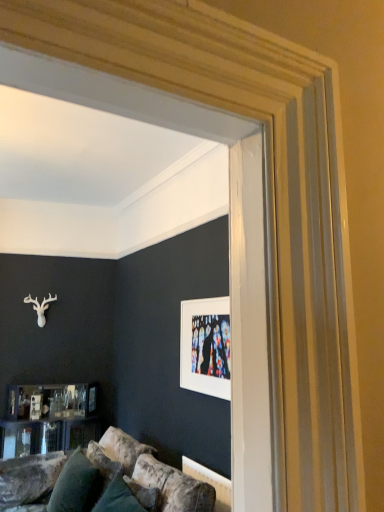
Question: Considering the relative sizes of white matte picture frame at upper center and velvety green pillow at lower left in the image provided, is white matte picture frame at upper center wider than velvety green pillow at lower left?

Choices:
 (A) no
 (B) yes

Answer: (A)

Question: From a real-world perspective, is white matte picture frame at upper center located higher than velvety green pillow at lower left?

Choices:
 (A) yes
 (B) no

Answer: (A)

Question: From the image's perspective, is white matte picture frame at upper center above velvety green pillow at lower left?

Choices:
 (A) no
 (B) yes

Answer: (B)

Question: Can you confirm if white matte picture frame at upper center is smaller than velvety green pillow at lower left?

Choices:
 (A) yes
 (B) no

Answer: (A)

Question: Is white matte picture frame at upper center positioned with its back to velvety green pillow at lower left?

Choices:
 (A) yes
 (B) no

Answer: (B)

Question: Does white matte picture frame at upper center appear on the right side of velvety green pillow at lower left?

Choices:
 (A) no
 (B) yes

Answer: (B)

Question: Is velvety green pillow at lower left far from white matte picture frame at upper center?

Choices:
 (A) no
 (B) yes

Answer: (B)

Question: From the image's perspective, would you say velvety green pillow at lower left is shown under white matte picture frame at upper center?

Choices:
 (A) yes
 (B) no

Answer: (A)

Question: Is velvety green pillow at lower left wider than white matte picture frame at upper center?

Choices:
 (A) yes
 (B) no

Answer: (A)

Question: Considering the relative positions of velvety green pillow at lower left and white matte picture frame at upper center in the image provided, is velvety green pillow at lower left to the left of white matte picture frame at upper center from the viewer's perspective?

Choices:
 (A) yes
 (B) no

Answer: (A)

Question: From the image's perspective, is velvety green pillow at lower left on top of white matte picture frame at upper center?

Choices:
 (A) no
 (B) yes

Answer: (A)

Question: Is velvety green pillow at lower left taller than white matte picture frame at upper center?

Choices:
 (A) yes
 (B) no

Answer: (B)

Question: Would you say white matte picture frame at upper center is to the left or to the right of velvety green pillow at lower left in the picture?

Choices:
 (A) right
 (B) left

Answer: (A)